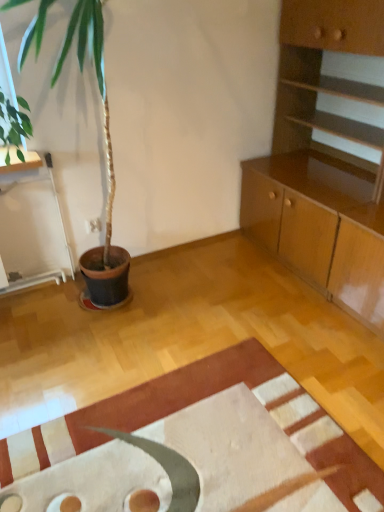
Find the location of a particular element. Image resolution: width=384 pixels, height=512 pixels. textured beige rug at center is located at coordinates (140, 407).

What do you see at coordinates (140, 407) in the screenshot?
I see `textured beige rug at center` at bounding box center [140, 407].

Locate an element on the screen. This screenshot has height=512, width=384. light brown wood cabinet at upper right is located at coordinates pos(323,162).

Describe the element at coordinates (323, 162) in the screenshot. This screenshot has height=512, width=384. I see `light brown wood cabinet at upper right` at that location.

This screenshot has height=512, width=384. I want to click on textured beige rug at center, so click(140, 407).

Is textured beige rug at center to the right of light brown wood cabinet at upper right from the viewer's perspective?

Incorrect, textured beige rug at center is not on the right side of light brown wood cabinet at upper right.

Which object is closer to the camera, textured beige rug at center or light brown wood cabinet at upper right?

textured beige rug at center is more forward.

Is point (124, 401) closer to viewer compared to point (288, 36)?

That is True.

From the image's perspective, is textured beige rug at center above or below light brown wood cabinet at upper right?

textured beige rug at center is below light brown wood cabinet at upper right.

From a real-world perspective, is textured beige rug at center located beneath light brown wood cabinet at upper right?

Indeed, from a real-world perspective, textured beige rug at center is positioned beneath light brown wood cabinet at upper right.

Is textured beige rug at center wider or thinner than light brown wood cabinet at upper right?

Considering their sizes, textured beige rug at center looks broader than light brown wood cabinet at upper right.

Considering the sizes of objects textured beige rug at center and light brown wood cabinet at upper right in the image provided, who is shorter, textured beige rug at center or light brown wood cabinet at upper right?

With less height is textured beige rug at center.

Based on their sizes in the image, would you say textured beige rug at center is bigger or smaller than light brown wood cabinet at upper right?

textured beige rug at center is smaller than light brown wood cabinet at upper right.

Is textured beige rug at center located outside light brown wood cabinet at upper right?

textured beige rug at center is positioned outside light brown wood cabinet at upper right.

Can you see textured beige rug at center touching light brown wood cabinet at upper right?

There is a gap between textured beige rug at center and light brown wood cabinet at upper right.

Could you tell me if textured beige rug at center is facing light brown wood cabinet at upper right?

No, textured beige rug at center is not aimed at light brown wood cabinet at upper right.

How many degrees apart are the facing directions of textured beige rug at center and light brown wood cabinet at upper right?

The angular difference between textured beige rug at center and light brown wood cabinet at upper right is 1.48 degrees.

In order to click on mat in front of the light brown wood cabinet at upper right in this screenshot , I will do `click(140, 407)`.

Considering the relative positions of light brown wood cabinet at upper right and textured beige rug at center in the image provided, is light brown wood cabinet at upper right to the left of textured beige rug at center from the viewer's perspective?

In fact, light brown wood cabinet at upper right is to the right of textured beige rug at center.

From the picture: Does light brown wood cabinet at upper right lie in front of textured beige rug at center?

No, it is behind textured beige rug at center.

Consider the image. Which point is more forward, (278, 190) or (81, 415)?

The point (81, 415) is in front.

From the image's perspective, which object appears higher, light brown wood cabinet at upper right or textured beige rug at center?

light brown wood cabinet at upper right appears higher in the image.

From a real-world perspective, is light brown wood cabinet at upper right below textured beige rug at center?

Actually, light brown wood cabinet at upper right is physically above textured beige rug at center in the real world.

Considering the relative sizes of light brown wood cabinet at upper right and textured beige rug at center in the image provided, is light brown wood cabinet at upper right wider than textured beige rug at center?

Incorrect, the width of light brown wood cabinet at upper right does not surpass that of textured beige rug at center.

Looking at this image, considering the relative sizes of light brown wood cabinet at upper right and textured beige rug at center in the image provided, is light brown wood cabinet at upper right shorter than textured beige rug at center?

Incorrect, the height of light brown wood cabinet at upper right does not fall short of that of textured beige rug at center.

Does light brown wood cabinet at upper right have a smaller size compared to textured beige rug at center?

No, light brown wood cabinet at upper right is not smaller than textured beige rug at center.

Is textured beige rug at center surrounded by light brown wood cabinet at upper right?

No, textured beige rug at center is not a part of light brown wood cabinet at upper right.

Looking at this image, is light brown wood cabinet at upper right not close to textured beige rug at center?

light brown wood cabinet at upper right is positioned a significant distance from textured beige rug at center.

Is light brown wood cabinet at upper right aimed at textured beige rug at center?

No, light brown wood cabinet at upper right is not turned towards textured beige rug at center.

What's the angular difference between light brown wood cabinet at upper right and textured beige rug at center's facing directions?

They differ by 1.48 degrees in their facing directions.

In order to click on mat lying on the left of light brown wood cabinet at upper right in this screenshot , I will do `click(140, 407)`.

Locate an element on the screen. The image size is (384, 512). cabinetry to the right of textured beige rug at center is located at coordinates (323, 162).

Identify the location of cabinetry behind the textured beige rug at center. The width and height of the screenshot is (384, 512). (323, 162).